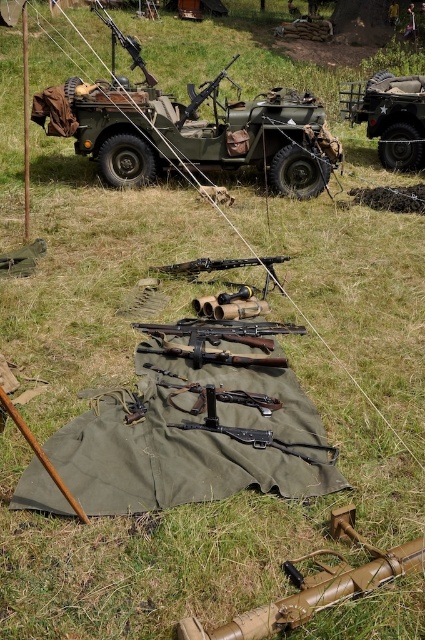
Question: Which object is the closest to the green matte military jeep at upper center?

Choices:
 (A) brown wood pole at left
 (B) green matte military vehicle at center
 (C) matte black rifle at center
 (D) matte black machine gun at center

Answer: (B)

Question: Does green matte military vehicle at center have a lesser width compared to matte black rifle at center?

Choices:
 (A) yes
 (B) no

Answer: (A)

Question: Considering the real-world distances, which object is farthest from the matte black rifle at center?

Choices:
 (A) green matte military vehicle at center
 (B) matte black rifle at upper center
 (C) brown wood pole at left

Answer: (A)

Question: Does green matte military jeep at upper center have a greater width compared to matte black machine gun at center?

Choices:
 (A) yes
 (B) no

Answer: (B)

Question: Does green matte military vehicle at center have a lesser width compared to matte black rifle at upper center?

Choices:
 (A) yes
 (B) no

Answer: (A)

Question: Among these objects, which one is farthest from the camera?

Choices:
 (A) green matte military jeep at upper center
 (B) green matte military vehicle at center

Answer: (A)